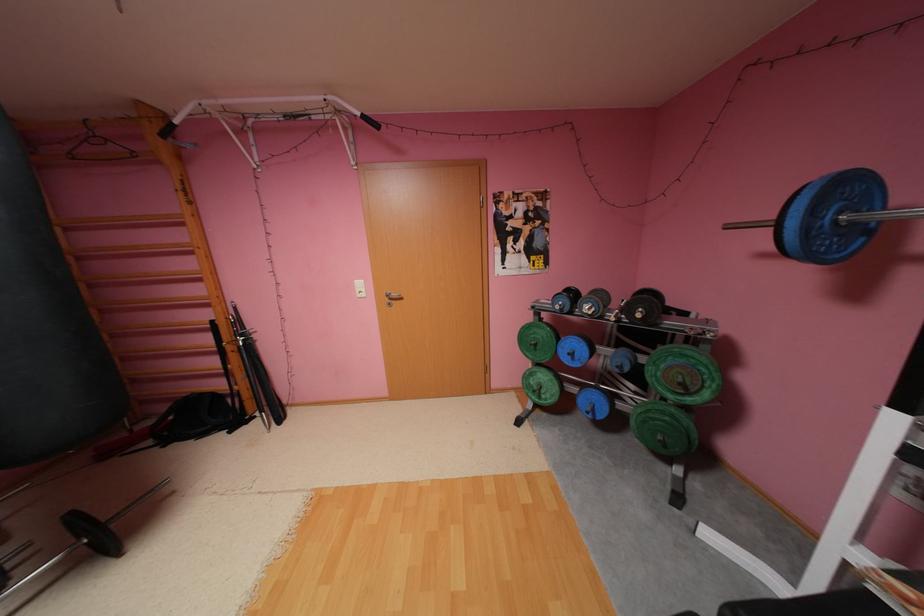
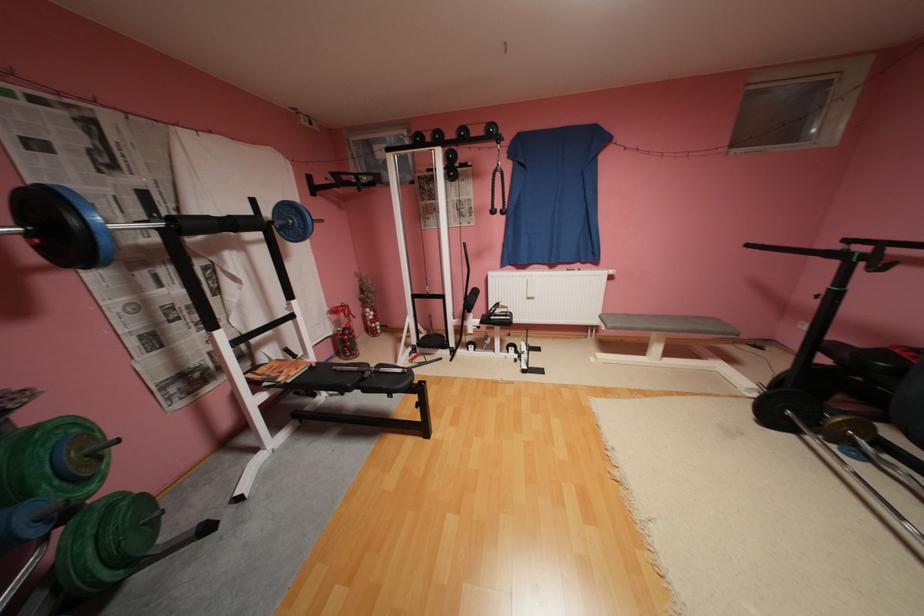
Question: I am providing you with two images of the same scene from different viewpoints. After the viewpoint changes to image2, which objects are now occluded?

Choices:
 (A) black machine handlebar
 (B) blue weight plate
 (C) green weight plate
 (D) none of these

Answer: (D)